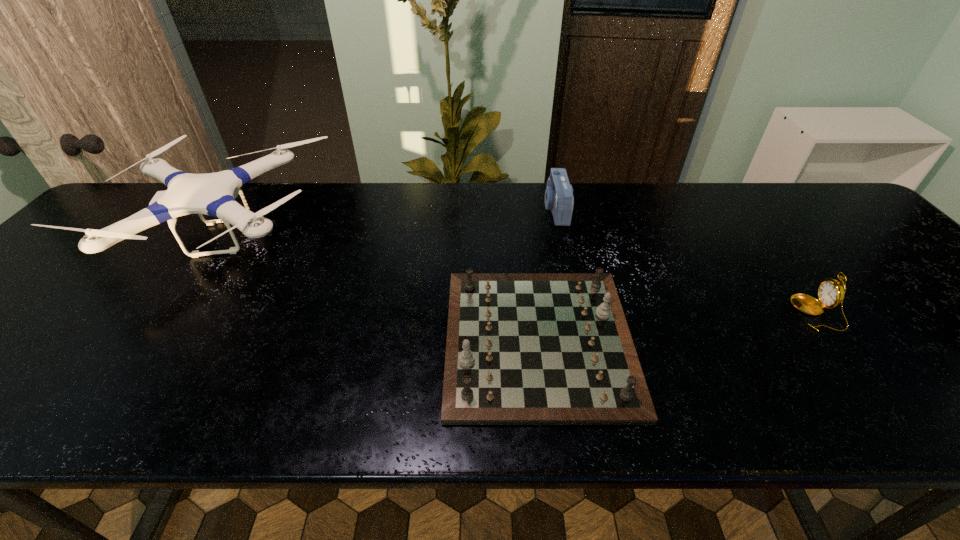
Locate an element on the screen. This screenshot has width=960, height=540. free space located 0.050m on the face of the pocket watch is located at coordinates pos(774,313).

This screenshot has width=960, height=540. I want to click on free space located on the face of the pocket watch, so click(x=770, y=313).

Find the location of a particular element. This screenshot has height=540, width=960. free location located 0.180m on the board of the chessboard is located at coordinates (362, 341).

Where is `vacant space located 0.350m on the board of the chessboard`? This screenshot has width=960, height=540. vacant space located 0.350m on the board of the chessboard is located at coordinates (282, 341).

At what (x,y) coordinates should I click in order to perform the action: click on free space located 0.180m on the board of the chessboard. Please return your answer as a coordinate pair (x, y). Image resolution: width=960 pixels, height=540 pixels. Looking at the image, I should click on (362, 341).

Locate an element on the screen. This screenshot has width=960, height=540. drone at the far edge is located at coordinates (213, 194).

Where is `camera that is at the far edge`? This screenshot has height=540, width=960. camera that is at the far edge is located at coordinates (559, 198).

This screenshot has height=540, width=960. Identify the location of object at the near edge. (522, 348).

I want to click on object located at the left edge, so click(x=213, y=194).

Identify the location of object situated at the far left corner. (213, 194).